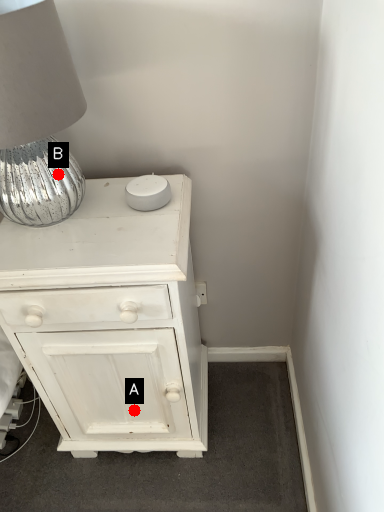
Question: Two points are circled on the image, labeled by A and B beside each circle. Which point appears farthest from the camera in this image?

Choices:
 (A) A is further
 (B) B is further

Answer: (A)